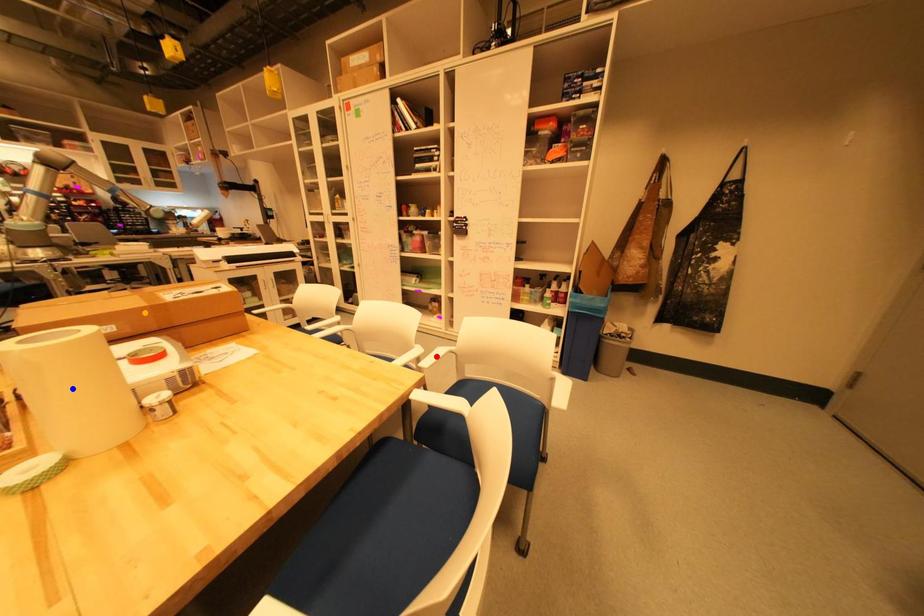
Order these from nearest to farthest:
blue point | orange point | red point

blue point < orange point < red point